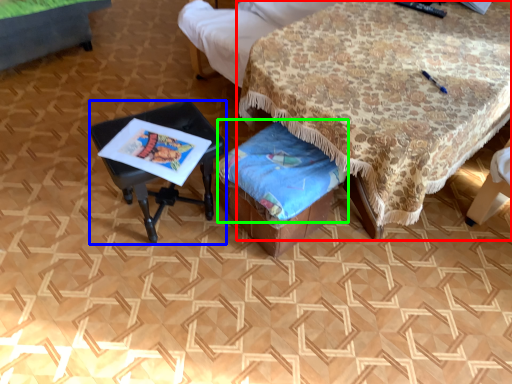
Question: Which is nearer to the table (highlighted by a red box)? table (highlighted by a blue box) or blanket (highlighted by a green box).

Choices:
 (A) table
 (B) blanket

Answer: (B)